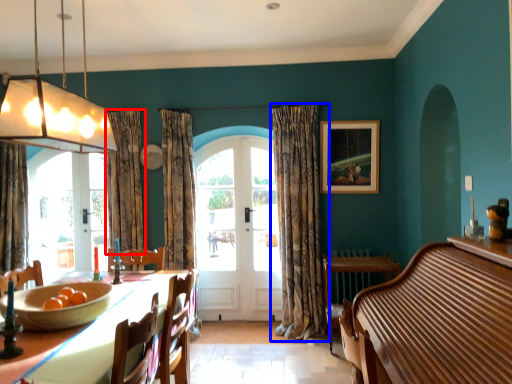
Question: Which object is further to the camera taking this photo, curtain (highlighted by a red box) or curtain (highlighted by a blue box)?

Choices:
 (A) curtain
 (B) curtain

Answer: (A)